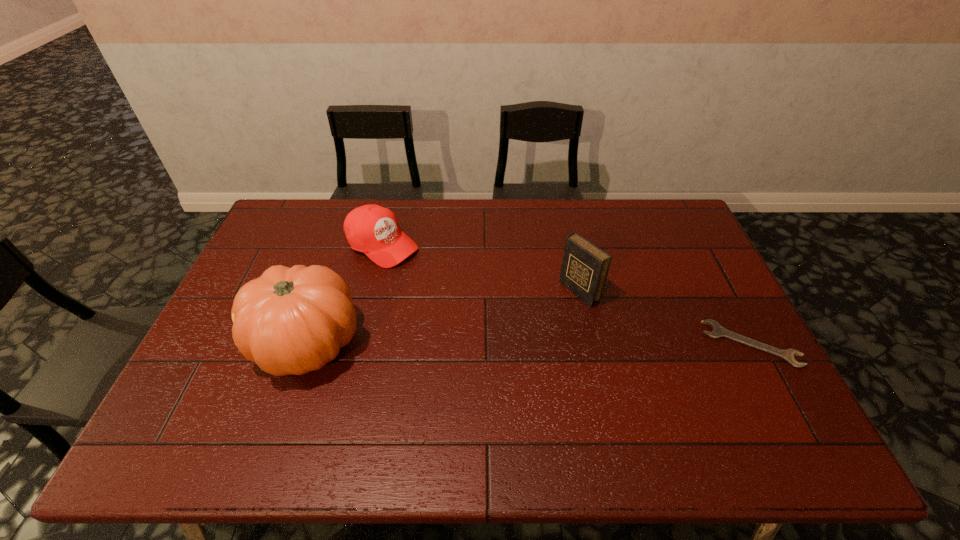
Where is `pumpkin`? Image resolution: width=960 pixels, height=540 pixels. pumpkin is located at coordinates (294, 320).

This screenshot has width=960, height=540. In order to click on the shortest object in this screenshot , I will do `click(718, 331)`.

At what (x,y) coordinates should I click in order to perform the action: click on the rightmost object. Please return your answer as a coordinate pair (x, y). The width and height of the screenshot is (960, 540). Looking at the image, I should click on (718, 331).

Where is `the third object from left to right`? The image size is (960, 540). the third object from left to right is located at coordinates (584, 269).

The width and height of the screenshot is (960, 540). In order to click on diary in this screenshot , I will do `click(584, 269)`.

Where is `the second shortest object`? This screenshot has height=540, width=960. the second shortest object is located at coordinates (372, 229).

Find the location of `baseball cap`. baseball cap is located at coordinates (372, 229).

In order to click on vacant space positioned on the carved face of the tallest object in this screenshot , I will do `click(234, 345)`.

In order to click on free space located on the carved face of the tallest object in this screenshot , I will do `click(215, 345)`.

In order to click on vacant region located 0.150m on the back of the shortest object in this screenshot , I will do `click(718, 284)`.